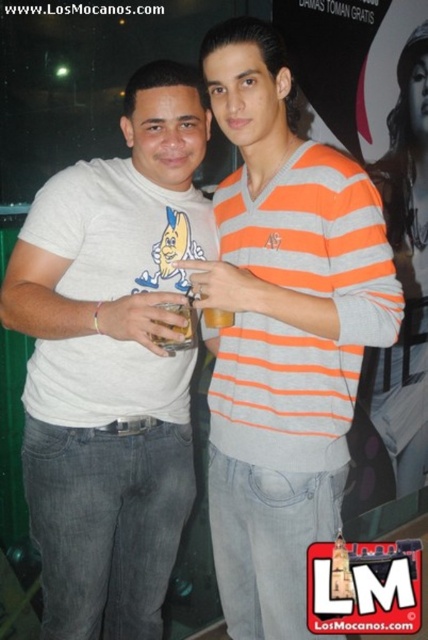
Does white cotton t-shirt at center come in front of orange striped sweater at center?

No, white cotton t-shirt at center is further to the viewer.

Does point (146, 420) come behind point (288, 225)?

Yes, it is.

Image resolution: width=428 pixels, height=640 pixels. What do you see at coordinates (112, 362) in the screenshot? I see `white cotton t-shirt at center` at bounding box center [112, 362].

Where is `white cotton t-shirt at center`? This screenshot has height=640, width=428. white cotton t-shirt at center is located at coordinates (112, 362).

Which is behind, point (237, 426) or point (189, 336)?

The point (237, 426) is more distant.

Who is higher up, orange striped sweater at center or translucent plastic cup at center?

Positioned higher is translucent plastic cup at center.

In order to click on orange striped sweater at center in this screenshot , I will do `click(282, 332)`.

Does point (133, 397) lie behind point (175, 349)?

Yes, point (133, 397) is farther from viewer.

Who is lower down, white cotton t-shirt at center or translucent plastic cup at center?

white cotton t-shirt at center

Which is behind, point (158, 332) or point (196, 323)?

Point (196, 323)

Find the location of a particular element. This screenshot has height=640, width=428. white cotton t-shirt at center is located at coordinates (112, 362).